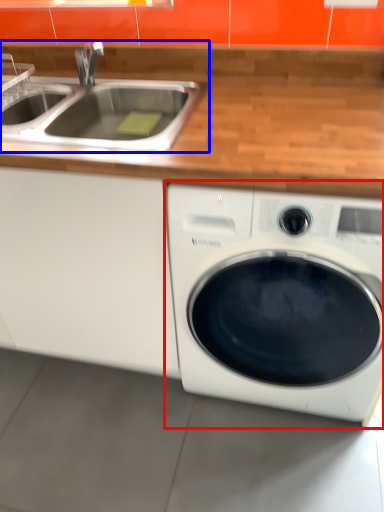
Question: Among these objects, which one is farthest to the camera, washing machine (highlighted by a red box) or sink (highlighted by a blue box)?

Choices:
 (A) washing machine
 (B) sink

Answer: (B)